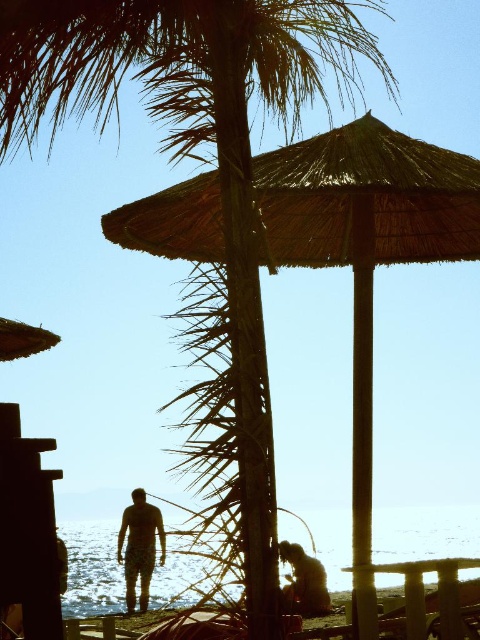
Question: Which object is farther from the camera taking this photo?

Choices:
 (A) thatched straw umbrella at center
 (B) camouflage pants at center

Answer: (B)

Question: Does camouflage pants at center appear on the right side of brown fur cat at lower center?

Choices:
 (A) no
 (B) yes

Answer: (A)

Question: Considering the relative positions of thatched straw umbrella at center and camouflage pants at center in the image provided, where is thatched straw umbrella at center located with respect to camouflage pants at center?

Choices:
 (A) above
 (B) below

Answer: (A)

Question: Does thatched straw umbrella at center have a lesser width compared to camouflage pants at center?

Choices:
 (A) yes
 (B) no

Answer: (B)

Question: Which point is closer to the camera taking this photo?

Choices:
 (A) (147, 576)
 (B) (336, 145)
 (C) (282, 595)

Answer: (C)

Question: Which object is the closest to the thatched straw umbrella at center?

Choices:
 (A) brown fur cat at lower center
 (B) camouflage pants at center

Answer: (A)